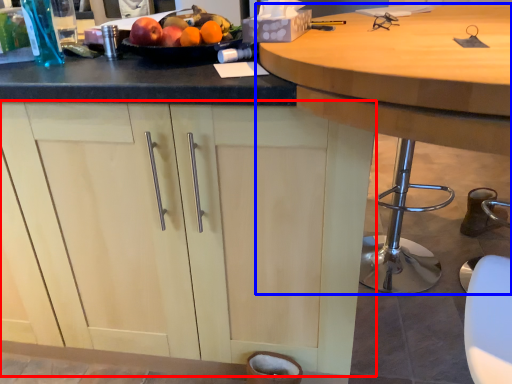
Question: Which point is closer to the camera, cabinetry (highlighted by a red box) or table (highlighted by a blue box)?

Choices:
 (A) cabinetry
 (B) table

Answer: (B)